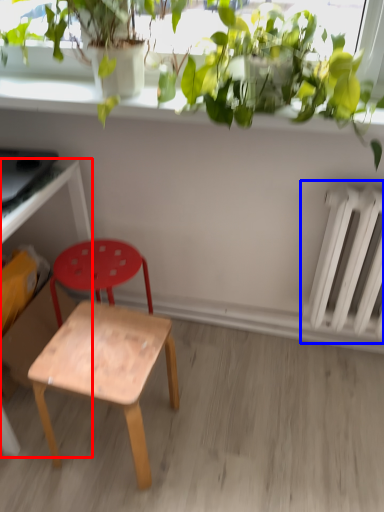
Question: Among these objects, which one is nearest to the camera, desk (highlighted by a red box) or radiator (highlighted by a blue box)?

Choices:
 (A) desk
 (B) radiator

Answer: (A)